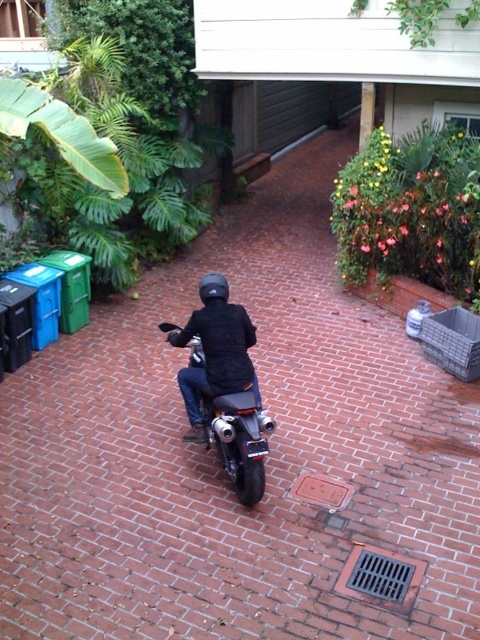
Is black leather jacket at center smaller than shiny chrome motorcycle at center?

Actually, black leather jacket at center might be larger than shiny chrome motorcycle at center.

Between black leather jacket at center and shiny chrome motorcycle at center, which one has more height?

black leather jacket at center

Describe the element at coordinates (216, 352) in the screenshot. The height and width of the screenshot is (640, 480). I see `black leather jacket at center` at that location.

This screenshot has width=480, height=640. I want to click on black leather jacket at center, so click(216, 352).